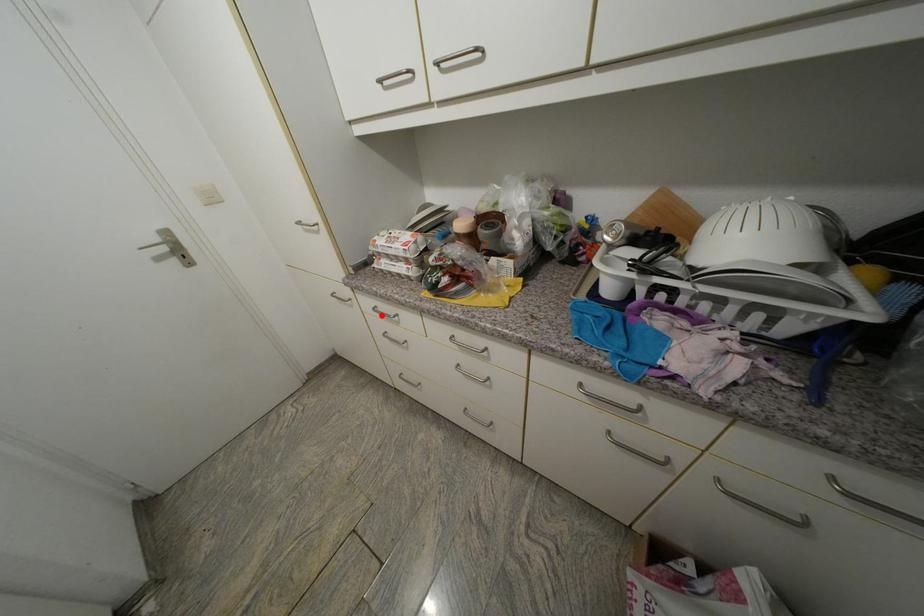
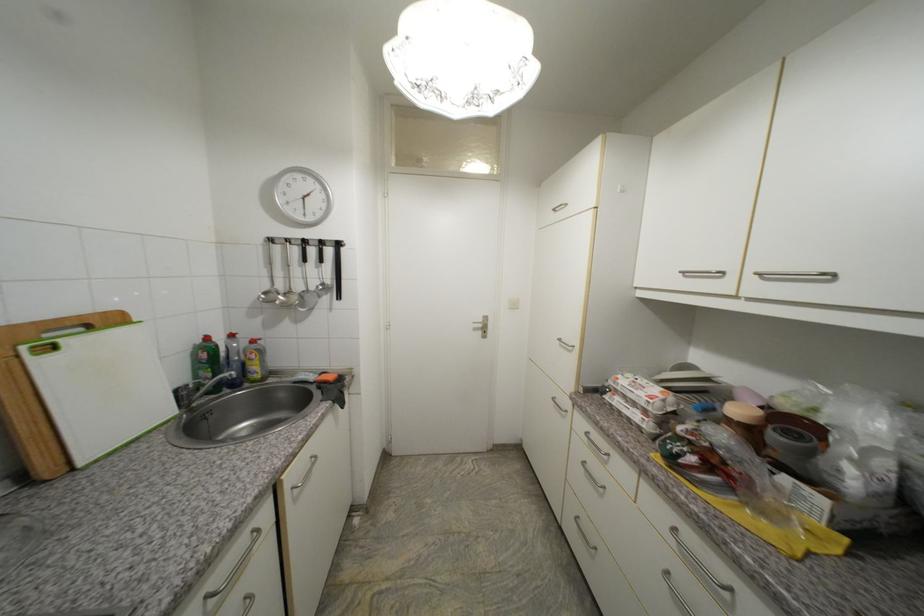
Find the pixel in the second image that matches the highlighted location in the first image.

(590, 440)